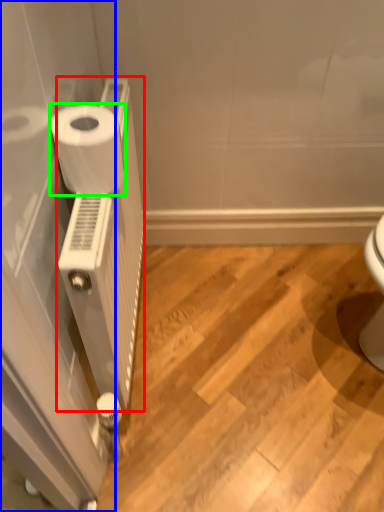
Question: Which object is positioned closest to radiator (highlighted by a red box)? Select from screen door (highlighted by a blue box) and toilet paper (highlighted by a green box).

Choices:
 (A) screen door
 (B) toilet paper

Answer: (A)